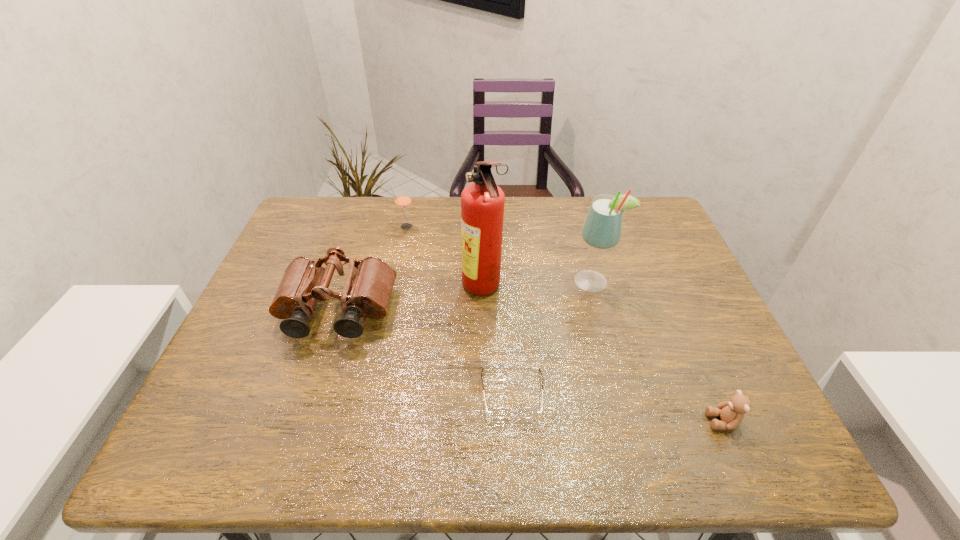
Identify the location of free space that satisfies the following two spatial constraints: 1. on the front-facing side of the fire extinguisher; 2. through the eyepieces of the binoculars. Image resolution: width=960 pixels, height=540 pixels. (483, 312).